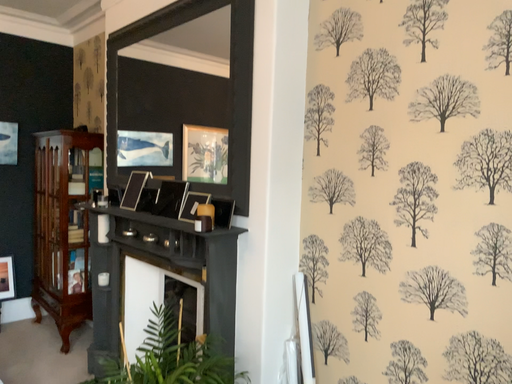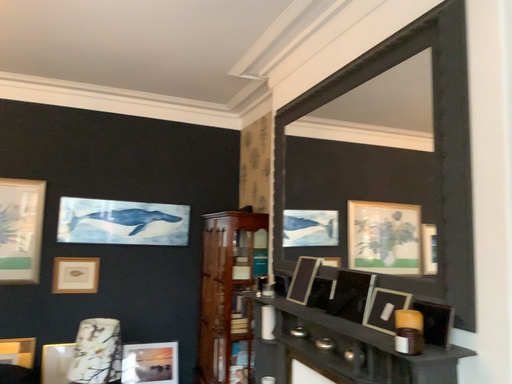
Question: How did the camera likely rotate when shooting the video?

Choices:
 (A) rotated left
 (B) rotated right

Answer: (A)